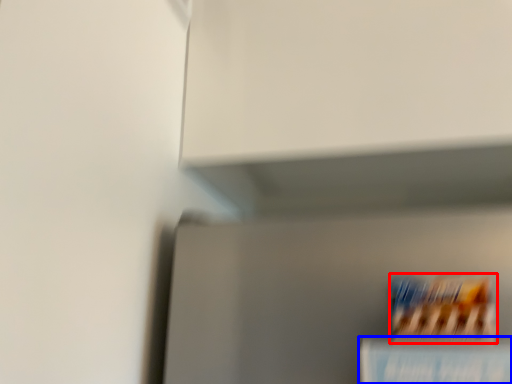
Question: Which point is closer to the camera, cereal (highlighted by a red box) or book (highlighted by a blue box)?

Choices:
 (A) cereal
 (B) book

Answer: (B)